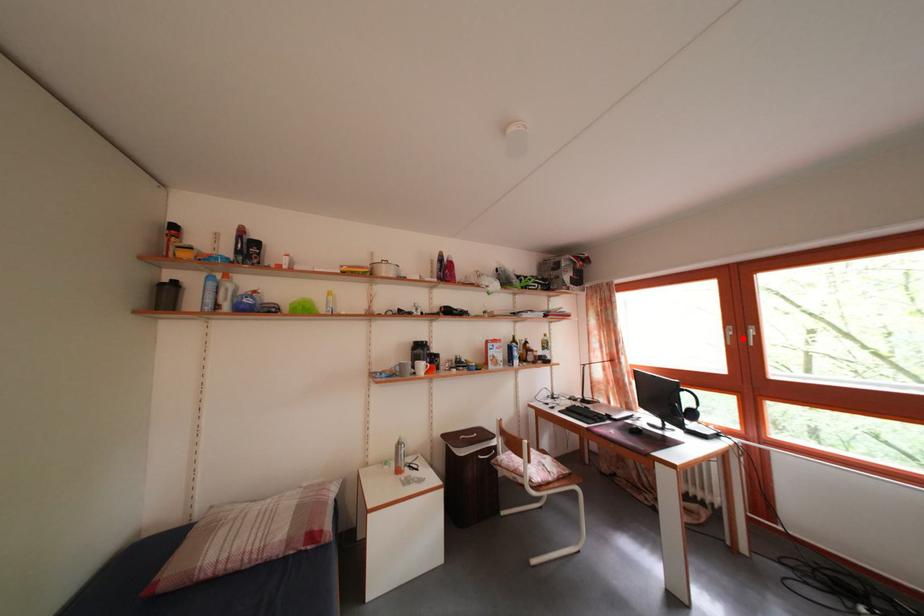
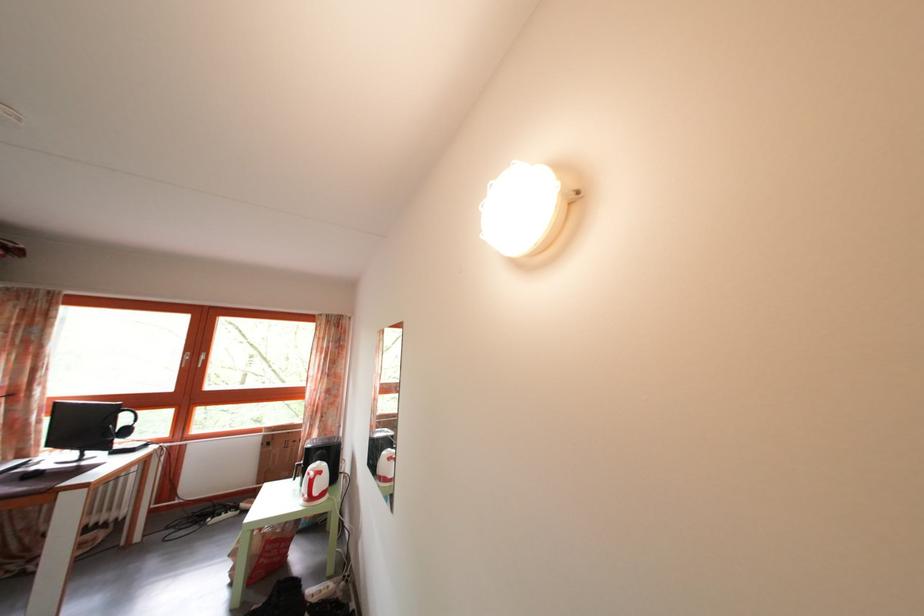
The point at the highlighted location is marked in the first image. Where is the corresponding point in the second image?

(199, 363)